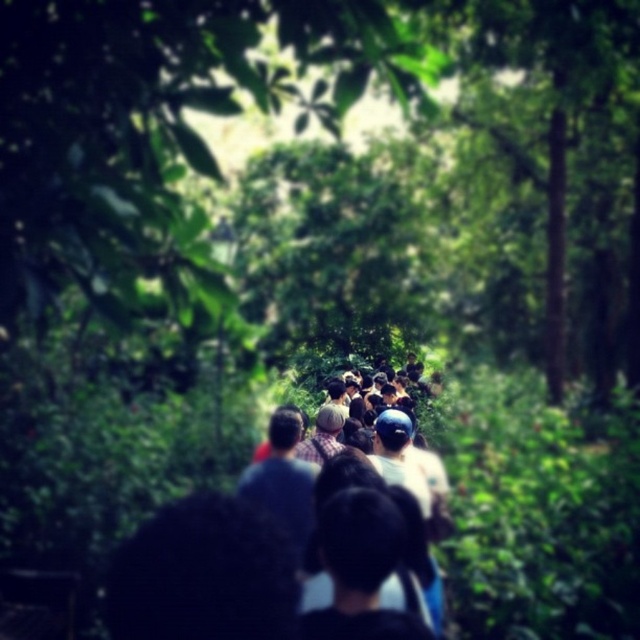
You are a photographer trying to capture a clear shot of the dark hair at center without the green leafy tree at center blocking it. Since the tree is thinner than the dark hair, can you move sideways to get a better angle?

The green leafy tree at center is thinner than the dark hair at center, so moving sideways might allow you to position yourself where the tree doesn not block the view of the dark hair at center. However, the exact feasibility depends on the surrounding foliage and path width.

You are a hiker who wants to take a photo of the dark hair at center without the green leafy tree at center blocking the view. Can you move sideways to achieve this?

The green leafy tree at center is only 1.69 meters away from dark hair at center. Moving sideways might not be enough to avoid the tree blocking the view, as the distance between them is relatively small. Consider moving further back or adjusting your angle to ensure the tree doesn not obstruct the shot.

You are a hiker who wants to take a photo of the dark hair at center and the green leafy tree at center. Which object should you focus on first if you want to capture both in the same frame without moving the camera?

The green leafy tree at center is taller than dark hair at center, so you should focus on the green leafy tree at center first to ensure it is in focus, then adjust to include the dark hair at center in the same frame.